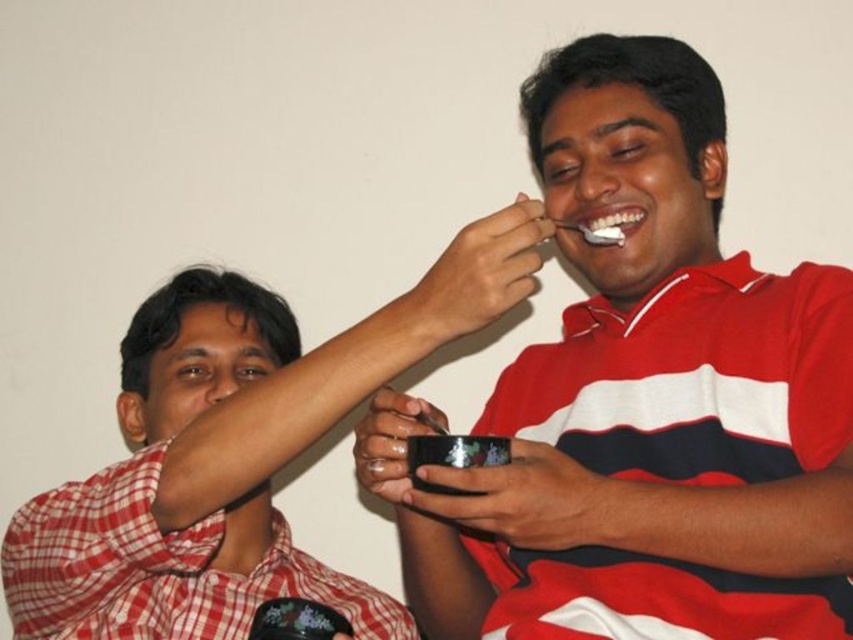
You are standing in front of the scene described. The coordinates of the matte black bowl at upper center are given as point A. If you want to place a new object at point B, which is 0.1 units to the right of point A, what would be the coordinates of point B?

The coordinates of point B would be calculated by adding 0.1 to the x value of point A. Since point A is at coordinates x 0.717, y 0.279, adding 0.1 to the x coordinate gives 0.817. Thus, point B is at coordinates (236,522).

Consider the image. You are a chef preparing a dish and need to choose between the matte black bowl at center and the matte black bowl at upper center. Which bowl is more suitable if you require a wider base for stability?

The matte black bowl at upper center is thicker than the matte black bowl at center, making it more suitable for a stable base.

You are standing in the room and want to reach the point marked as point (444, 508). If you take a step forward of 1 meter, will you be able to reach it?

The point (444, 508) is 91.38 centimeters away from the viewer. Taking a step forward of 1 meter would move you beyond the point, so you would have to step back to reach it.